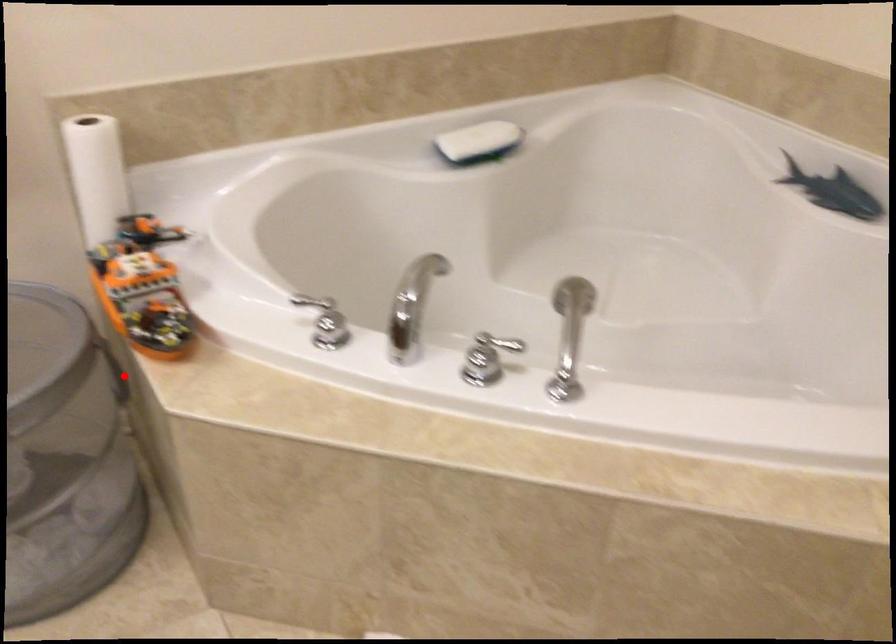
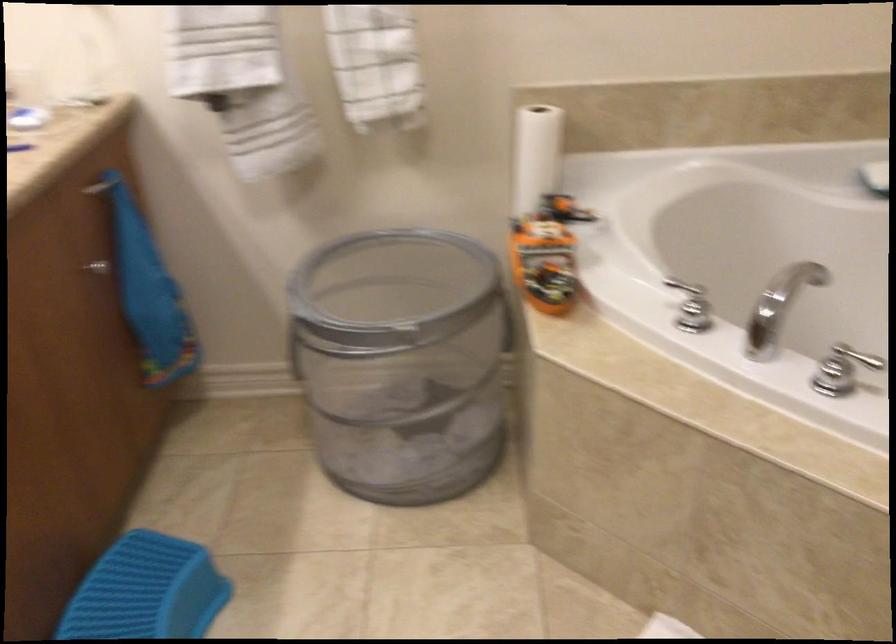
Find the pixel in the second image that matches the highlighted location in the first image.

(506, 322)